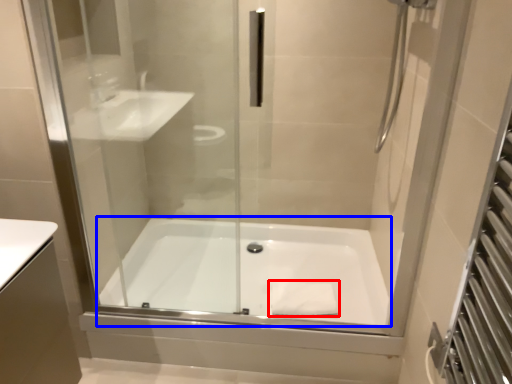
Question: Which of the following is the closest to the observer, material (highlighted by a red box) or bathtub (highlighted by a blue box)?

Choices:
 (A) material
 (B) bathtub

Answer: (B)